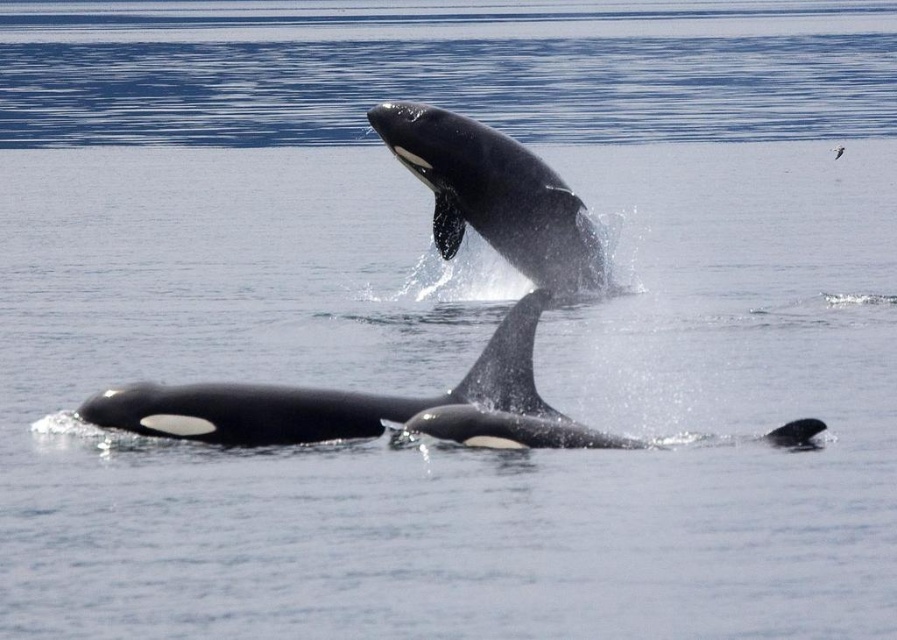
Question: Where is black smooth dolphin at center located in relation to black smooth whale at center in the image?

Choices:
 (A) above
 (B) below

Answer: (B)

Question: Based on their relative distances, which object is farther from the black smooth whale at center?

Choices:
 (A) black smooth dolphin at lower right
 (B) black smooth dolphin at center

Answer: (A)

Question: Considering the real-world distances, which object is closest to the black smooth whale at center?

Choices:
 (A) black smooth dolphin at lower right
 (B) black smooth dolphin at center

Answer: (B)

Question: Where is black smooth whale at center located in relation to black smooth dolphin at lower right in the image?

Choices:
 (A) below
 (B) above

Answer: (B)

Question: Among these objects, which one is farthest from the camera?

Choices:
 (A) black smooth dolphin at center
 (B) black smooth whale at center
 (C) black smooth dolphin at lower right

Answer: (B)

Question: Is black smooth dolphin at center positioned at the back of black smooth whale at center?

Choices:
 (A) yes
 (B) no

Answer: (B)